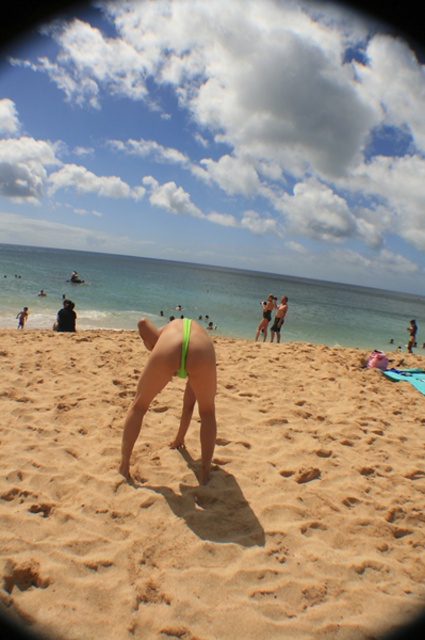
Is light brown sandy beach at center positioned behind green fabric bikini bottom at center?

No, it is in front of green fabric bikini bottom at center.

Between light brown sandy beach at center and green fabric bikini bottom at center, which one is positioned higher?

Positioned higher is green fabric bikini bottom at center.

Where is `light brown sandy beach at center`? This screenshot has width=425, height=640. light brown sandy beach at center is located at coordinates (209, 493).

This screenshot has height=640, width=425. In order to click on light brown sandy beach at center in this screenshot , I will do `click(209, 493)`.

Can you confirm if light brown sandy beach at center is positioned above matte white bikini top at center?

Actually, light brown sandy beach at center is below matte white bikini top at center.

Is point (45, 557) closer to camera compared to point (183, 371)?

Yes, it is in front of point (183, 371).

The image size is (425, 640). Identify the location of light brown sandy beach at center. (209, 493).

This screenshot has height=640, width=425. What do you see at coordinates (150, 378) in the screenshot?
I see `green fabric bikini bottom at center` at bounding box center [150, 378].

Between point (158, 376) and point (183, 344), which one is positioned in front?

Point (183, 344)

You are a GUI agent. You are given a task and a screenshot of the screen. Output one action in this format:
    pyautogui.click(x=<x>, y=<y>)
    Task: Click on the green fabric bikini bottom at center
    The height and width of the screenshot is (640, 425).
    Given the screenshot: What is the action you would take?
    pyautogui.click(x=150, y=378)

Find the location of a particular element. Image resolution: width=425 pixels, height=640 pixels. green fabric bikini bottom at center is located at coordinates (150, 378).